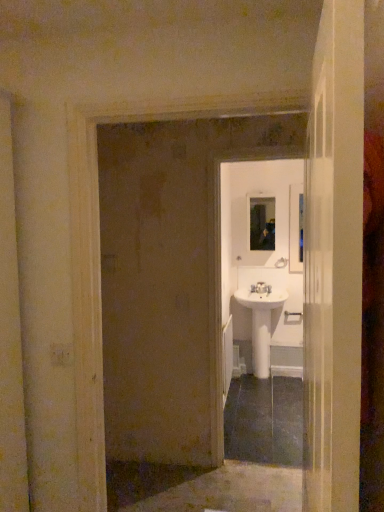
Question: Does white glossy door at center have a greater width compared to white glossy sink at center?

Choices:
 (A) yes
 (B) no

Answer: (A)

Question: From a real-world perspective, does white glossy door at center stand above white glossy sink at center?

Choices:
 (A) yes
 (B) no

Answer: (A)

Question: Is white glossy door at center positioned far away from white glossy sink at center?

Choices:
 (A) yes
 (B) no

Answer: (A)

Question: Can you confirm if white glossy door at center is smaller than white glossy sink at center?

Choices:
 (A) yes
 (B) no

Answer: (B)

Question: Is white glossy door at center to the left of white glossy sink at center from the viewer's perspective?

Choices:
 (A) no
 (B) yes

Answer: (B)

Question: From the image's perspective, is white glossy door at center beneath white glossy sink at center?

Choices:
 (A) no
 (B) yes

Answer: (A)

Question: Can you confirm if white glossy door at center is smaller than silver metallic door handle at center?

Choices:
 (A) yes
 (B) no

Answer: (B)

Question: Is white glossy door at center at the right side of silver metallic door handle at center?

Choices:
 (A) no
 (B) yes

Answer: (A)

Question: Can you confirm if white glossy door at center is shorter than silver metallic door handle at center?

Choices:
 (A) yes
 (B) no

Answer: (B)

Question: Is white glossy door at center wider than silver metallic door handle at center?

Choices:
 (A) yes
 (B) no

Answer: (A)

Question: From a real-world perspective, is white glossy door at center beneath silver metallic door handle at center?

Choices:
 (A) yes
 (B) no

Answer: (B)

Question: Is white glossy door at center not near silver metallic door handle at center?

Choices:
 (A) yes
 (B) no

Answer: (A)

Question: Does white plastic light switch at lower left lie behind metallic reflective mirror at center?

Choices:
 (A) no
 (B) yes

Answer: (A)